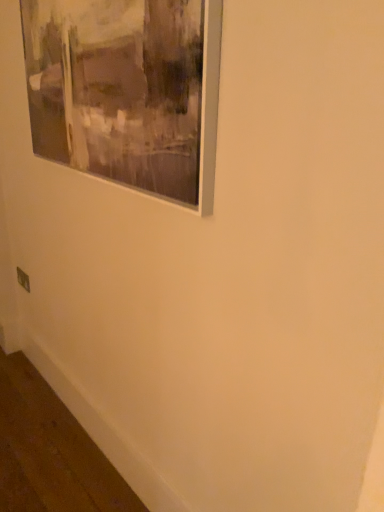
Question: Relative to metallic gray outlet at lower left, is matte gray picture frame at upper left in front or behind?

Choices:
 (A) front
 (B) behind

Answer: (A)

Question: Considering the positions of matte gray picture frame at upper left and metallic gray outlet at lower left in the image, is matte gray picture frame at upper left bigger or smaller than metallic gray outlet at lower left?

Choices:
 (A) small
 (B) big

Answer: (B)

Question: Visually, is matte gray picture frame at upper left positioned to the left or to the right of metallic gray outlet at lower left?

Choices:
 (A) right
 (B) left

Answer: (A)

Question: In the image, is metallic gray outlet at lower left positioned in front of or behind matte gray picture frame at upper left?

Choices:
 (A) front
 (B) behind

Answer: (B)

Question: In terms of height, does metallic gray outlet at lower left look taller or shorter compared to matte gray picture frame at upper left?

Choices:
 (A) tall
 (B) short

Answer: (B)

Question: Is metallic gray outlet at lower left situated inside matte gray picture frame at upper left or outside?

Choices:
 (A) outside
 (B) inside

Answer: (A)

Question: From the image's perspective, is metallic gray outlet at lower left above or below matte gray picture frame at upper left?

Choices:
 (A) above
 (B) below

Answer: (B)